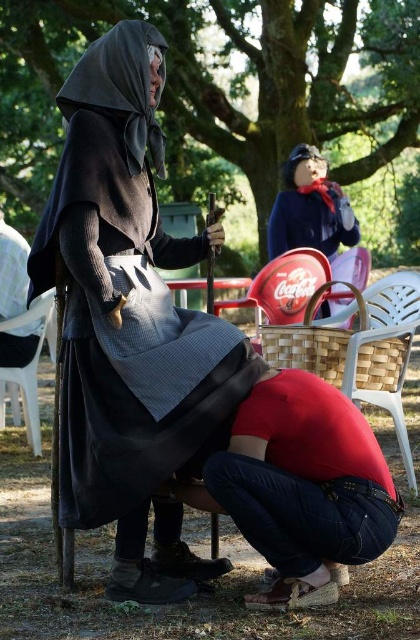
You are standing in the park and see two points marked in the image. Which point is closer to you, point (346, 225) or point (52, 307)?

Point (52, 307) is closer to you because it is nearer than point (346, 225) which is further away.

You are a photographer trying to capture a portrait of both the matte black cape at center and the matte blue dress at upper center. To ensure both subjects are in frame, should you adjust your camera to focus more to the left or the right of the current position?

The matte black cape at center is positioned on the left side of the matte blue dress at upper center. Therefore, to include both in the frame, you should adjust your camera to focus more to the left to capture the matte black cape at center and ensure the matte blue dress at upper center remains in view.

You are a delivery person who needs to place a package on the white plastic chair at lower left. You are currently standing next to the matte blue dress at upper center. Can you reach the chair without moving the chair or the dress?

The distance between the matte blue dress at upper center and the white plastic chair at lower left is 5.75 feet, so yes, you can reach the chair without moving either object since the distance is manageable for delivery.